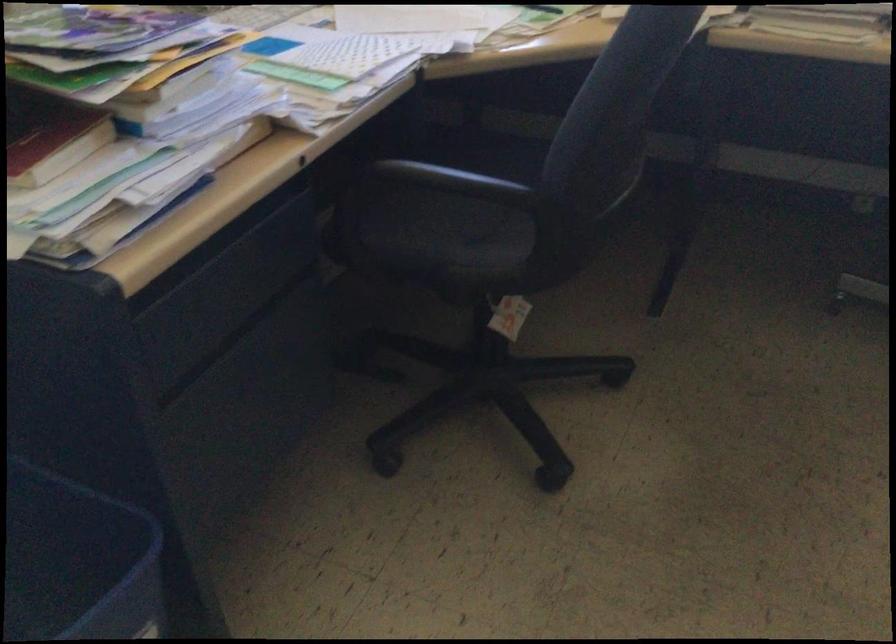
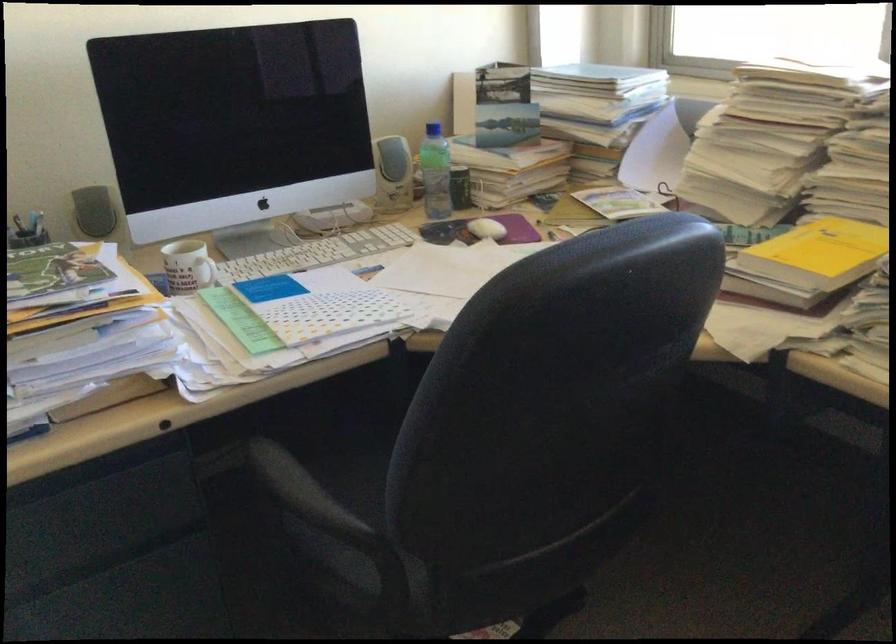
In the second image, find the point that corresponds to the point at 493,194 in the first image.

(314, 521)